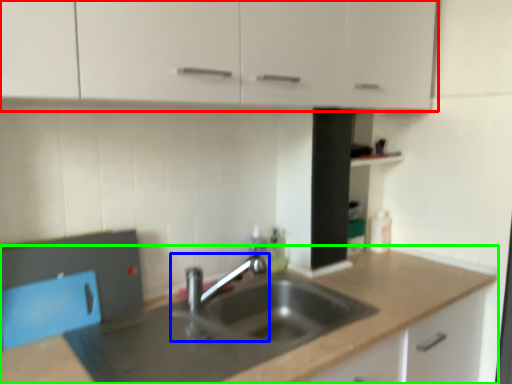
Question: Which object is positioned farthest from cabinetry (highlighted by a red box)? Select from tap (highlighted by a blue box) and countertop (highlighted by a green box).

Choices:
 (A) tap
 (B) countertop

Answer: (B)